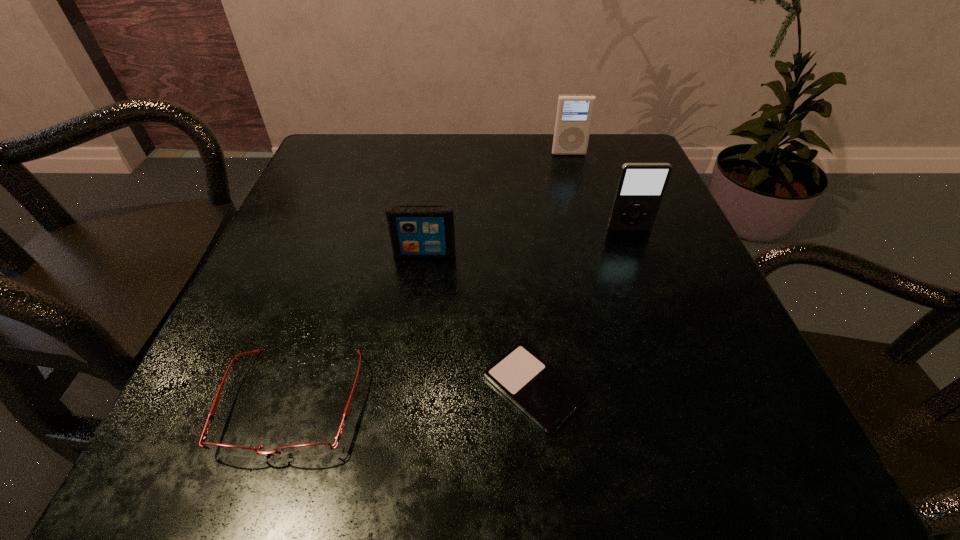
Where is `free space that satisfies the following two spatial constraints: 1. on the front screen of the third iPod from right to left; 2. on the left side of the third tallest iPod`? The image size is (960, 540). free space that satisfies the following two spatial constraints: 1. on the front screen of the third iPod from right to left; 2. on the left side of the third tallest iPod is located at coordinates (407, 388).

The image size is (960, 540). I want to click on vacant area that satisfies the following two spatial constraints: 1. on the front screen of the third farthest object; 2. on the left side of the nearest iPod, so click(407, 388).